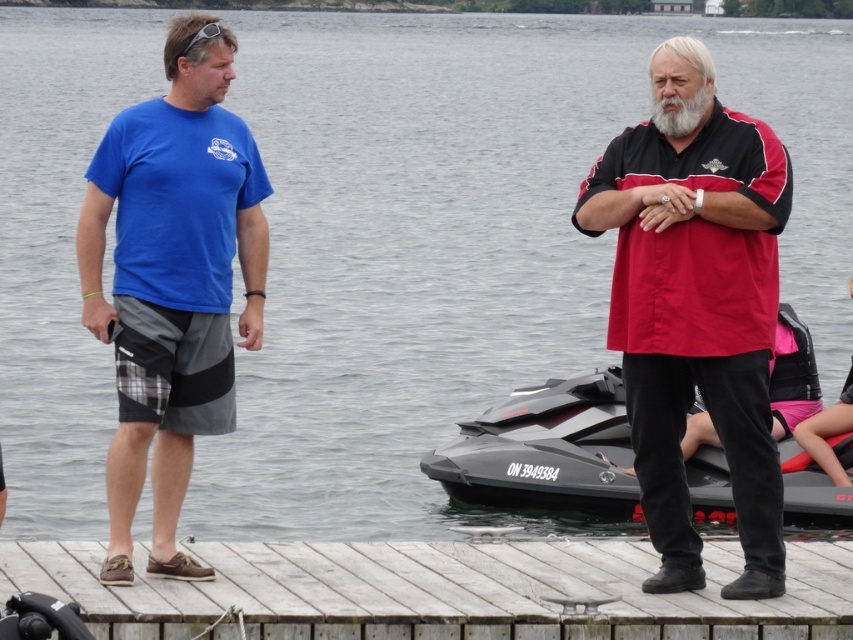
Question: Does red/black shirt at center come in front of black matte jet ski at lower center?

Choices:
 (A) yes
 (B) no

Answer: (A)

Question: Can you confirm if black matte jet ski at lower center is smaller than graywoollybeard at right?

Choices:
 (A) no
 (B) yes

Answer: (A)

Question: Which of the following is the closest to the observer?

Choices:
 (A) wooden at center
 (B) graywoollybeard at right
 (C) blue fabric shirt at left
 (D) red/black shirt at center

Answer: (A)

Question: Which of the following is the farthest from the observer?

Choices:
 (A) (675, 131)
 (B) (125, 269)

Answer: (A)

Question: Which of these objects is positioned closest to the blue fabric shirt at left?

Choices:
 (A) black matte jet ski at lower center
 (B) wooden at center
 (C) graywoollybeard at right

Answer: (B)

Question: Is red/black shirt at center positioned in front of wooden at center?

Choices:
 (A) no
 (B) yes

Answer: (A)